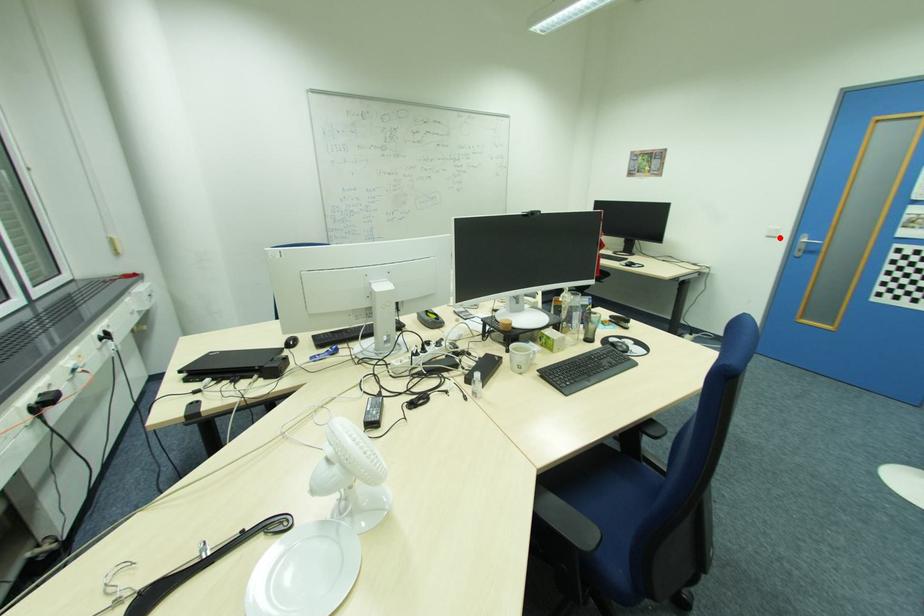
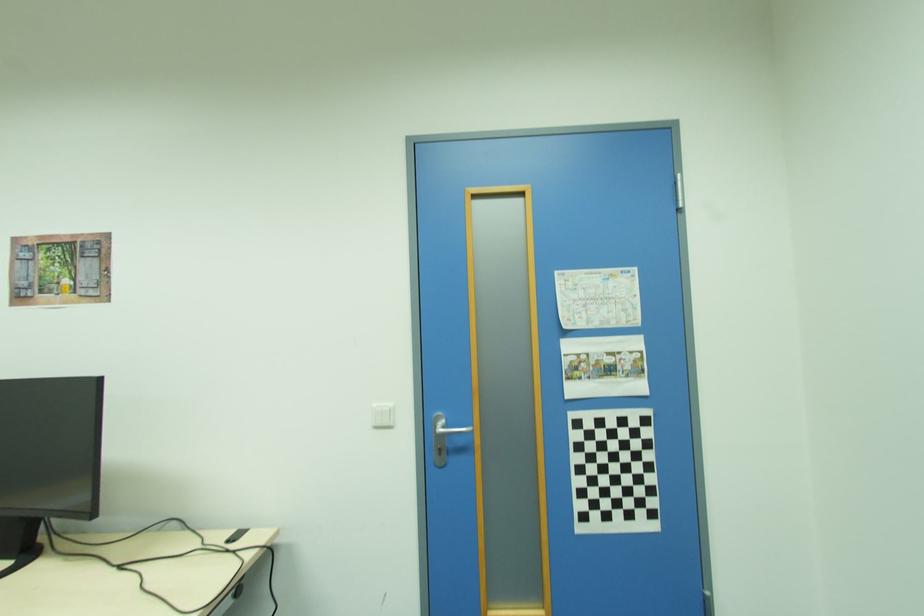
In the second image, find the point that corresponds to the highlighted location in the first image.

(394, 427)